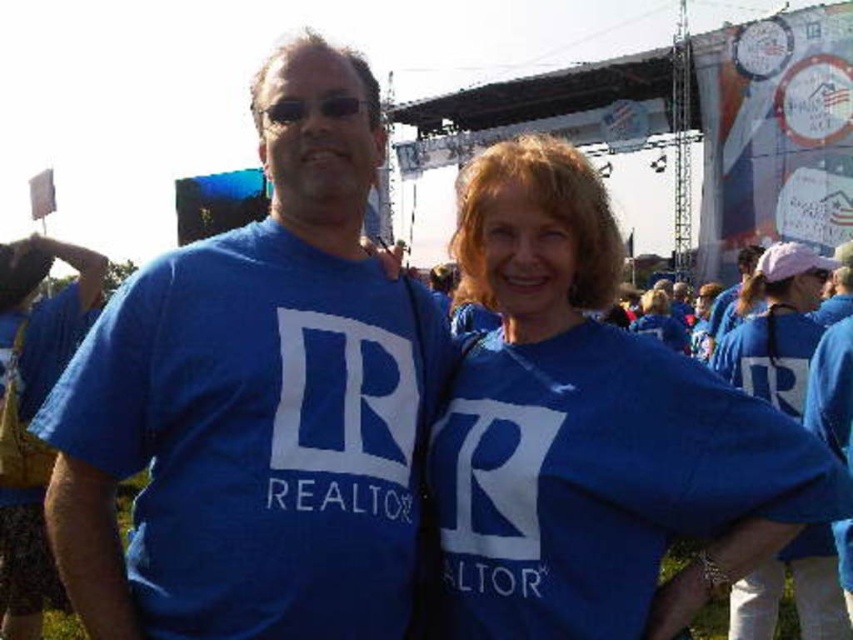
You are a photographer at a real estate event. You need to capture a photo of the matte blue shirt at right and the blue fabric shirt at center. The camera you have can focus on objects within 15 meters. Will both shirts be in focus?

The matte blue shirt at right is 17.61 meters away from the blue fabric shirt at center. Since the camera can only focus within 15 meters, the distance between them exceeds the focus range, so both shirts may not be in focus simultaneously.

You are a photographer at the event and need to adjust the lighting to ensure both the matte blue shirt at left and the blue fabric shirt at center are visible. Since one is blocking the other, which shirt should you move to avoid overlap?

The matte blue shirt at left is positioned over the blue fabric shirt at center, so moving the matte blue shirt at left would prevent it from blocking the blue fabric shirt at center.